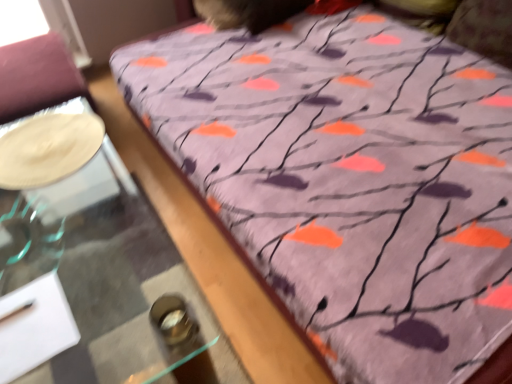
Question: Does point tap(193, 360) appear closer or farther from the camera than point tap(34, 124)?

Choices:
 (A) farther
 (B) closer

Answer: (B)

Question: From a real-world perspective, is transparent glass table at lower left physically located above or below white glossy plate at left?

Choices:
 (A) below
 (B) above

Answer: (A)

Question: Considering the positions of transparent glass table at lower left and white glossy plate at left in the image, is transparent glass table at lower left taller or shorter than white glossy plate at left?

Choices:
 (A) tall
 (B) short

Answer: (A)

Question: Considering the relative positions of white glossy plate at left and transparent glass table at lower left in the image provided, is white glossy plate at left to the left or to the right of transparent glass table at lower left?

Choices:
 (A) left
 (B) right

Answer: (A)

Question: In the image, is white glossy plate at left positioned in front of or behind transparent glass table at lower left?

Choices:
 (A) front
 (B) behind

Answer: (B)

Question: From their relative heights in the image, would you say white glossy plate at left is taller or shorter than transparent glass table at lower left?

Choices:
 (A) short
 (B) tall

Answer: (A)

Question: From the image's perspective, is white glossy plate at left located above or below transparent glass table at lower left?

Choices:
 (A) above
 (B) below

Answer: (A)